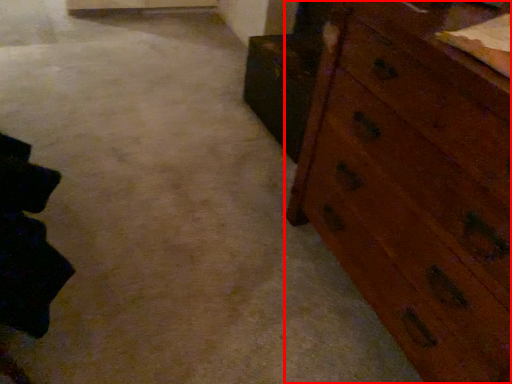
Question: From the image's perspective, where is chest of drawers (annotated by the red box) located relative to cabinetry?

Choices:
 (A) below
 (B) above

Answer: (A)